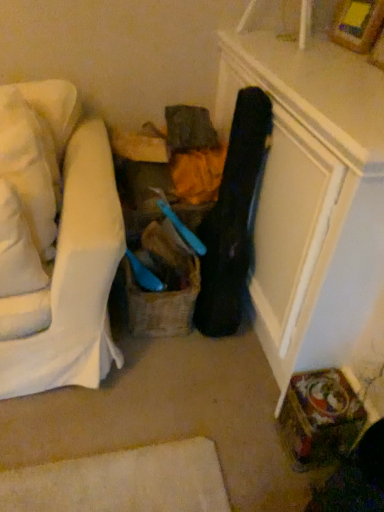
This screenshot has width=384, height=512. I want to click on vacant area that is in front of burlap basket at center, so click(x=166, y=369).